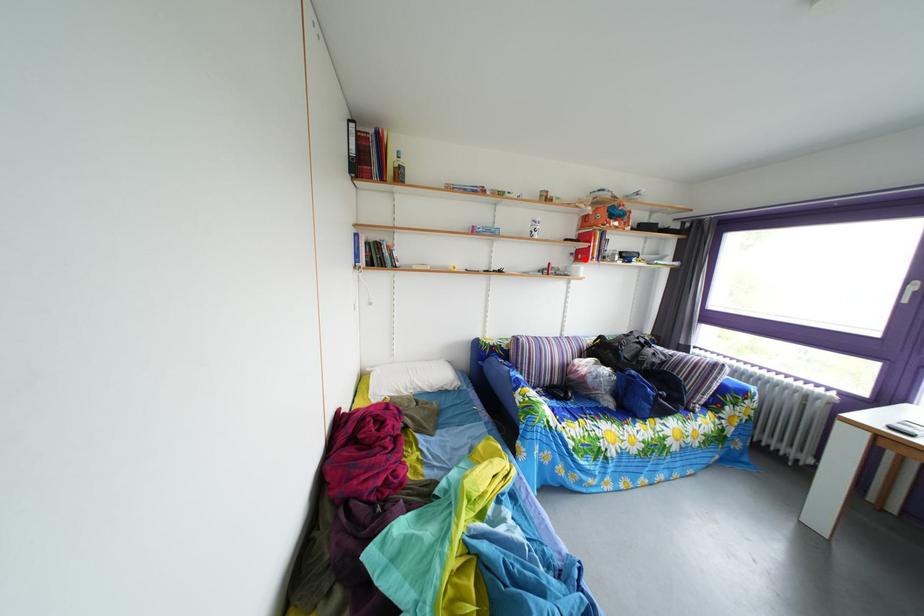
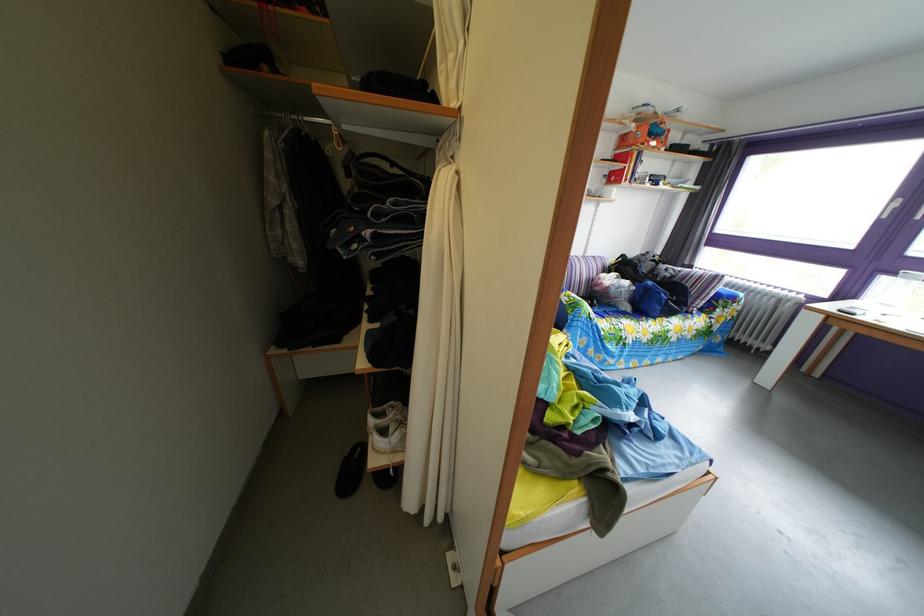
The point at the highlighted location is marked in the first image. Where is the corresponding point in the second image?

(618, 180)